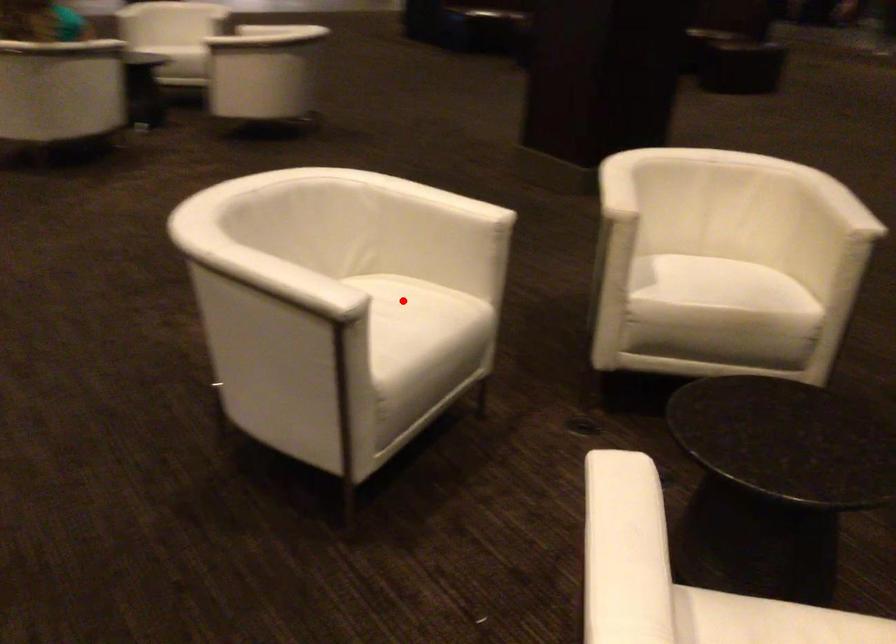
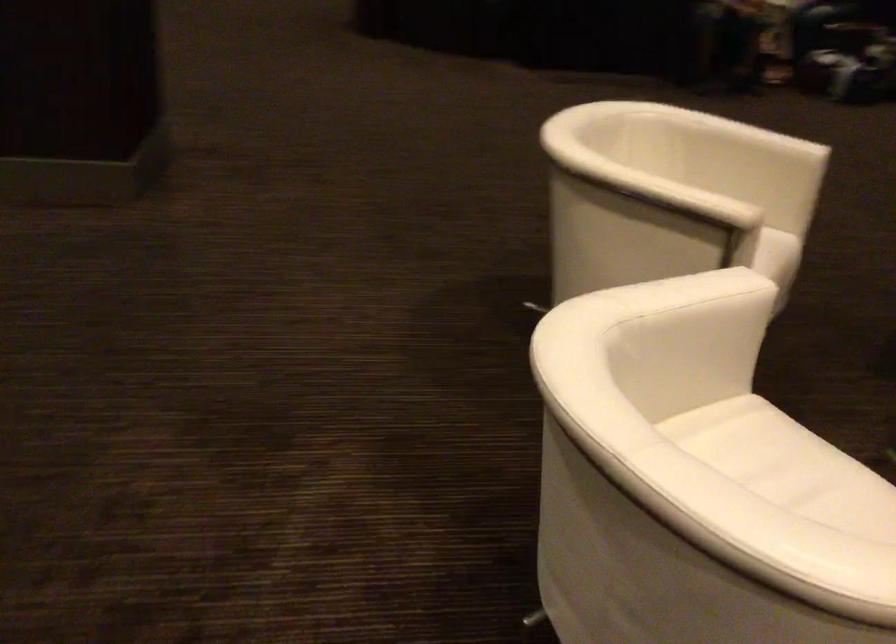
Where in the second image is the point corresponding to the highlighted location from the first image?

(767, 453)